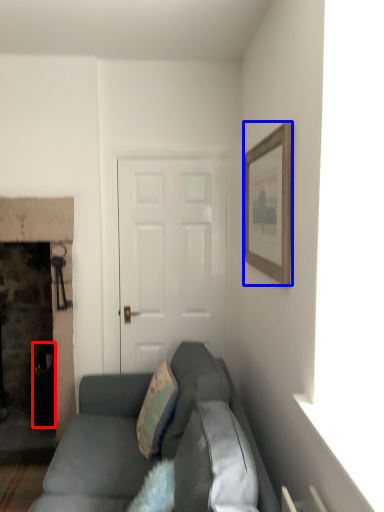
Question: Which object appears farthest to the camera in this image, trash bin/can (highlighted by a red box) or picture frame (highlighted by a blue box)?

Choices:
 (A) trash bin/can
 (B) picture frame

Answer: (A)